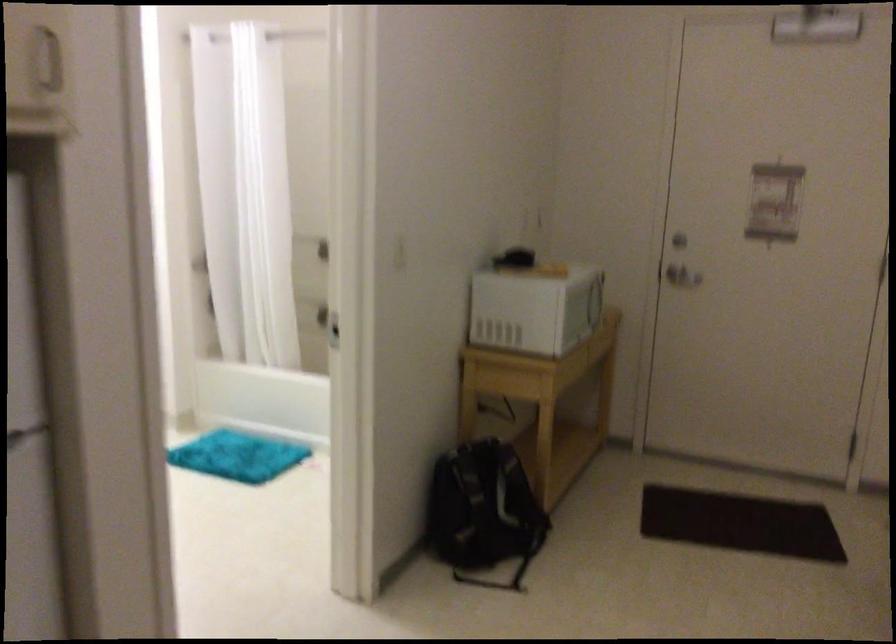
Find the location of a particular element. This screenshot has width=896, height=644. black backpack is located at coordinates (483, 512).